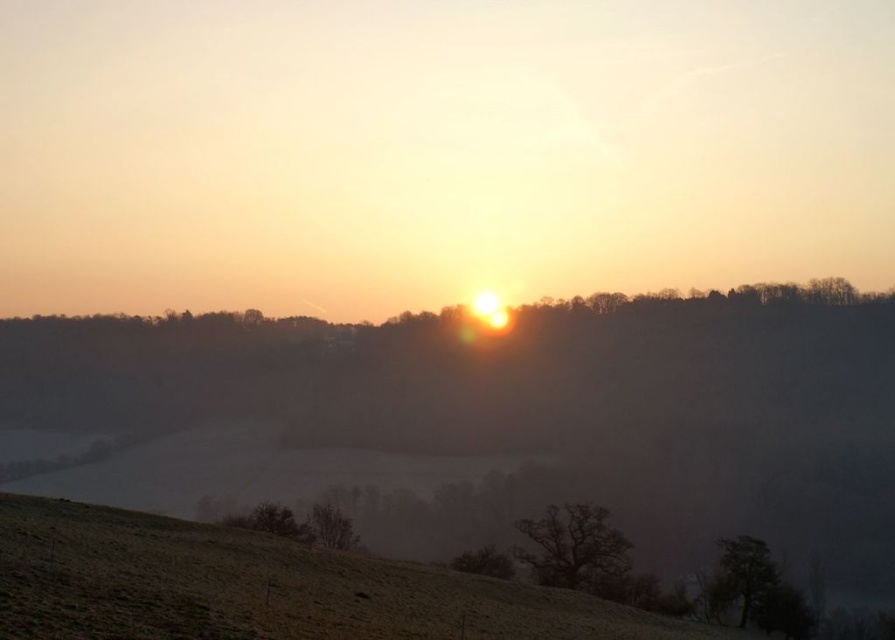
You are an observer standing at the base of the dark brown textured tree at lower center and want to walk to the dark brown textured tree at lower right. Which direction should you face to move towards the tree?

The dark brown textured tree at lower right is located to the right side of the dark brown textured tree at lower center, so you should face towards the right direction to move towards it.

You are standing at the base of the green matte tree at lower left and want to walk to the brown matte tree at lower center. Which direction should you walk to reach it?

You should walk towards the right because the brown matte tree at lower center is positioned to the right of the green matte tree at lower left.

You are an artist sketching this landscape. You want to draw the green matte tree at lower left and the brown matte tree at lower center accurately. Which tree should you draw first if you follow the rule of drawing objects that are closer to the viewer first?

The green matte tree at lower left should be drawn first because it is positioned over the brown matte tree at lower center, indicating it is closer to the viewer.